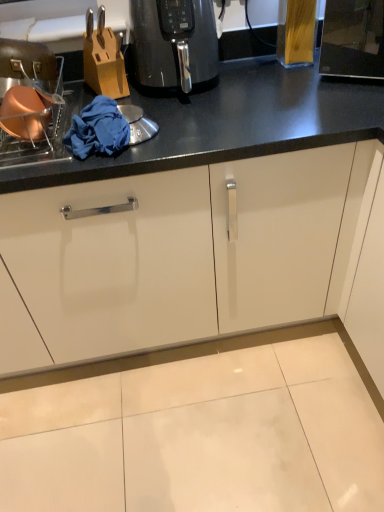
Question: Is black glossy air fryer at center looking in the opposite direction of matte copper pot at left?

Choices:
 (A) no
 (B) yes

Answer: (A)

Question: Is black glossy air fryer at center bigger than matte copper pot at left?

Choices:
 (A) yes
 (B) no

Answer: (B)

Question: Can you confirm if black glossy air fryer at center is positioned to the right of matte copper pot at left?

Choices:
 (A) yes
 (B) no

Answer: (A)

Question: Considering the relative sizes of black glossy air fryer at center and matte copper pot at left in the image provided, is black glossy air fryer at center wider than matte copper pot at left?

Choices:
 (A) yes
 (B) no

Answer: (B)

Question: From the image's perspective, is black glossy air fryer at center below matte copper pot at left?

Choices:
 (A) no
 (B) yes

Answer: (A)

Question: From the image's perspective, would you say black glossy air fryer at center is positioned over matte copper pot at left?

Choices:
 (A) no
 (B) yes

Answer: (B)

Question: From a real-world perspective, is matte copper pot at left positioned over blue fabric at left based on gravity?

Choices:
 (A) no
 (B) yes

Answer: (B)

Question: Considering the relative positions of matte copper pot at left and blue fabric at left in the image provided, is matte copper pot at left to the left of blue fabric at left from the viewer's perspective?

Choices:
 (A) no
 (B) yes

Answer: (B)

Question: Is matte copper pot at left closer to camera compared to blue fabric at left?

Choices:
 (A) no
 (B) yes

Answer: (B)

Question: Is the depth of matte copper pot at left greater than that of blue fabric at left?

Choices:
 (A) no
 (B) yes

Answer: (A)

Question: Is blue fabric at left at the back of matte copper pot at left?

Choices:
 (A) yes
 (B) no

Answer: (B)

Question: From the image's perspective, is matte copper pot at left beneath blue fabric at left?

Choices:
 (A) yes
 (B) no

Answer: (B)

Question: Does black glossy air fryer at center have a lesser width compared to blue fabric at left?

Choices:
 (A) yes
 (B) no

Answer: (B)